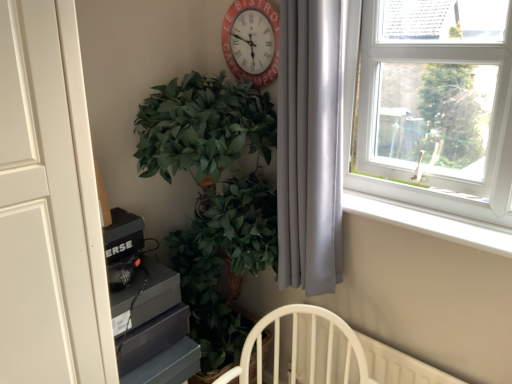
Question: From the image's perspective, is white plastic window at upper right located beneath silky gray curtain at right?

Choices:
 (A) no
 (B) yes

Answer: (A)

Question: From the image's perspective, is white plastic window at upper right over silky gray curtain at right?

Choices:
 (A) yes
 (B) no

Answer: (A)

Question: Are white plastic window at upper right and silky gray curtain at right located far from each other?

Choices:
 (A) yes
 (B) no

Answer: (B)

Question: Is white plastic window at upper right behind silky gray curtain at right?

Choices:
 (A) yes
 (B) no

Answer: (B)

Question: Considering the relative sizes of white plastic window at upper right and silky gray curtain at right in the image provided, is white plastic window at upper right thinner than silky gray curtain at right?

Choices:
 (A) yes
 (B) no

Answer: (B)

Question: Can you confirm if white plastic window at upper right is smaller than silky gray curtain at right?

Choices:
 (A) yes
 (B) no

Answer: (B)

Question: Can you confirm if green leafy plant at center-left is smaller than red painted wood clock at upper center?

Choices:
 (A) yes
 (B) no

Answer: (B)

Question: Does green leafy plant at center-left touch red painted wood clock at upper center?

Choices:
 (A) yes
 (B) no

Answer: (B)

Question: Is green leafy plant at center-left aimed at red painted wood clock at upper center?

Choices:
 (A) no
 (B) yes

Answer: (A)

Question: Is green leafy plant at center-left positioned with its back to red painted wood clock at upper center?

Choices:
 (A) yes
 (B) no

Answer: (B)

Question: From the image's perspective, is green leafy plant at center-left beneath red painted wood clock at upper center?

Choices:
 (A) no
 (B) yes

Answer: (B)

Question: Is green leafy plant at center-left at the left side of red painted wood clock at upper center?

Choices:
 (A) yes
 (B) no

Answer: (A)

Question: Is red painted wood clock at upper center to the right of green leafy plant at center-left from the viewer's perspective?

Choices:
 (A) yes
 (B) no

Answer: (A)